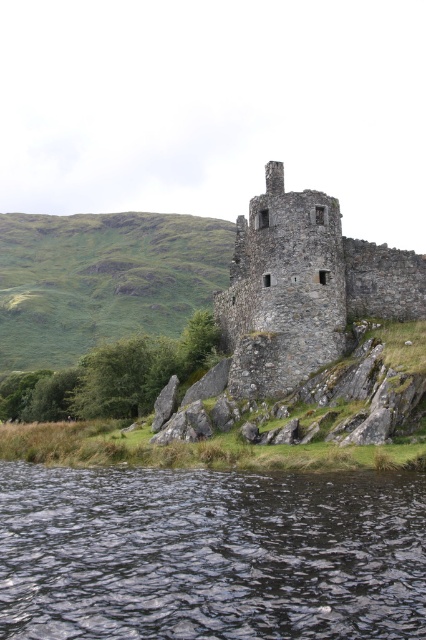
You are standing on the rocky outcrop near the rustic stone tower at center. You want to get to the dark liquid water at lower center. Which direction should you move relative to the tower?

You should move to the left of the rustic stone tower at center to reach the dark liquid water at lower center, as it is located to the left of the tower.

You are a tourist standing at the edge of the water, looking at the dark liquid water at lower center and the rustic stone tower at center. Which object is taller?

The rustic stone tower at center is taller than the dark liquid water at lower center.

You are standing on the rocky outcrop near the old castle structure. You want to reach the dark liquid water at lower center. According to the coordinates given, is the point at (209,554) the correct location to find the dark liquid water at lower center?

Yes, the point at (209,554) corresponds to the dark liquid water at lower center as stated in the Objects Description.